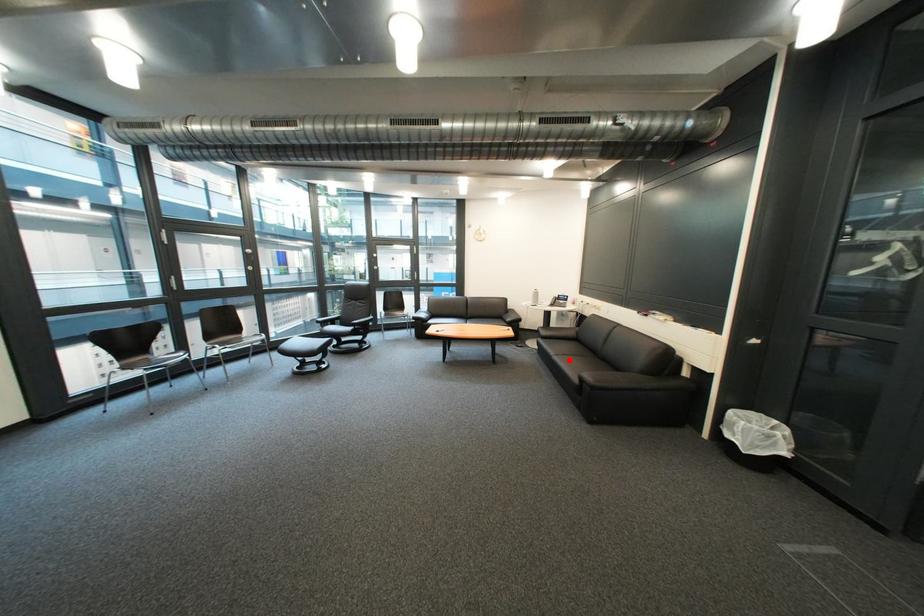
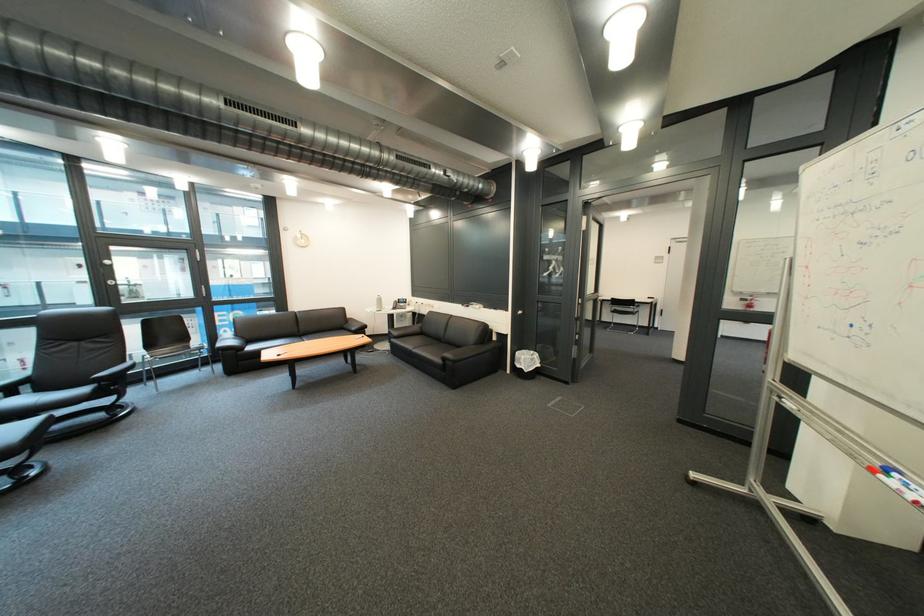
Where in the second image is the point corresponding to the highlighted location from the first image?

(429, 353)